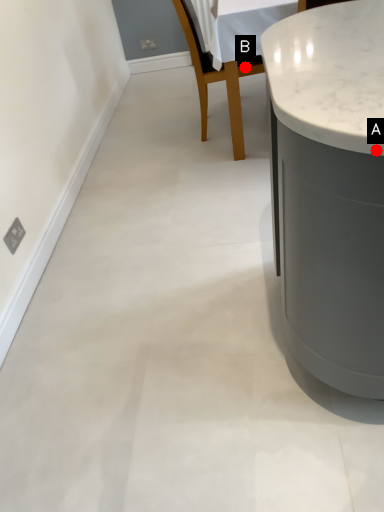
Question: Two points are circled on the image, labeled by A and B beside each circle. Which point is closer to the camera taking this photo?

Choices:
 (A) A is closer
 (B) B is closer

Answer: (A)